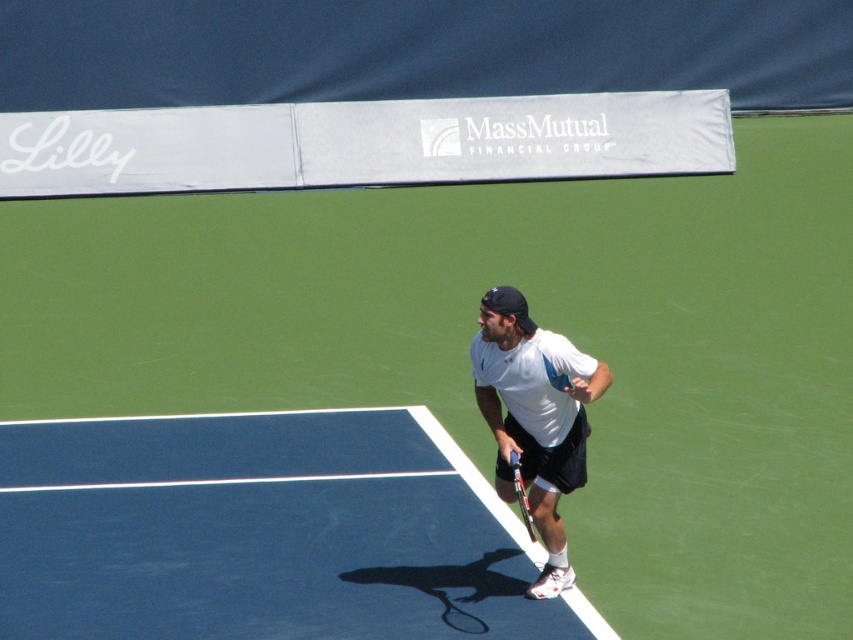
You are a tennis coach observing a player holding two rackets during a practice session. The player has a white matte tennis racket at center and a black metallic tennis racket at lower center. Which racket is wider?

The white matte tennis racket at center might be wider than the black metallic tennis racket at lower center according to the description.